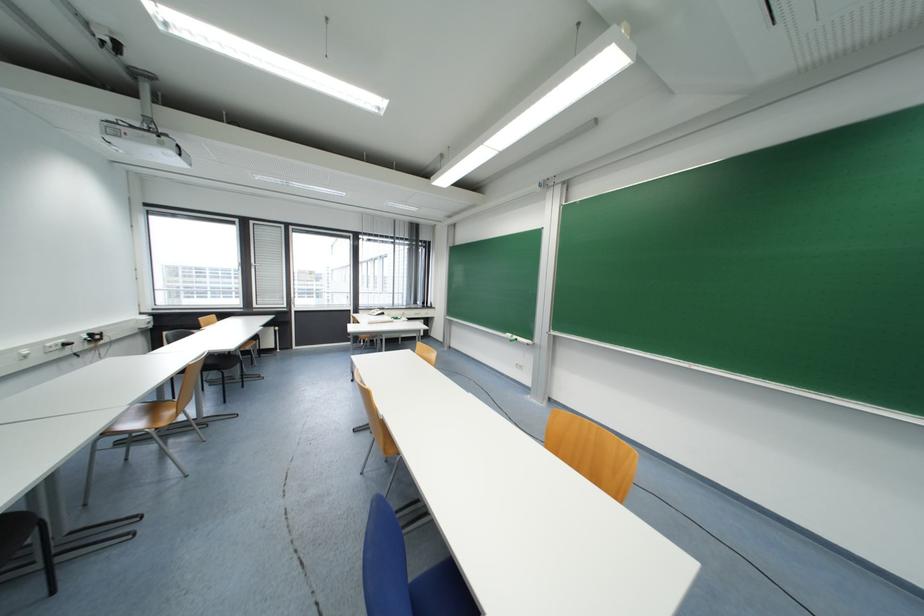
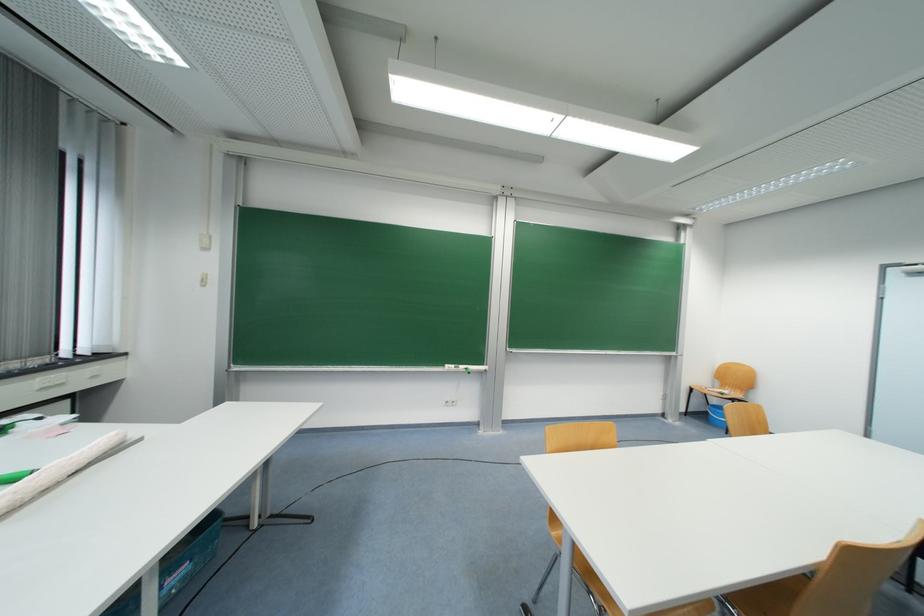
Locate, in the second image, the point that corresponds to (x=519, y=339) in the first image.

(467, 369)